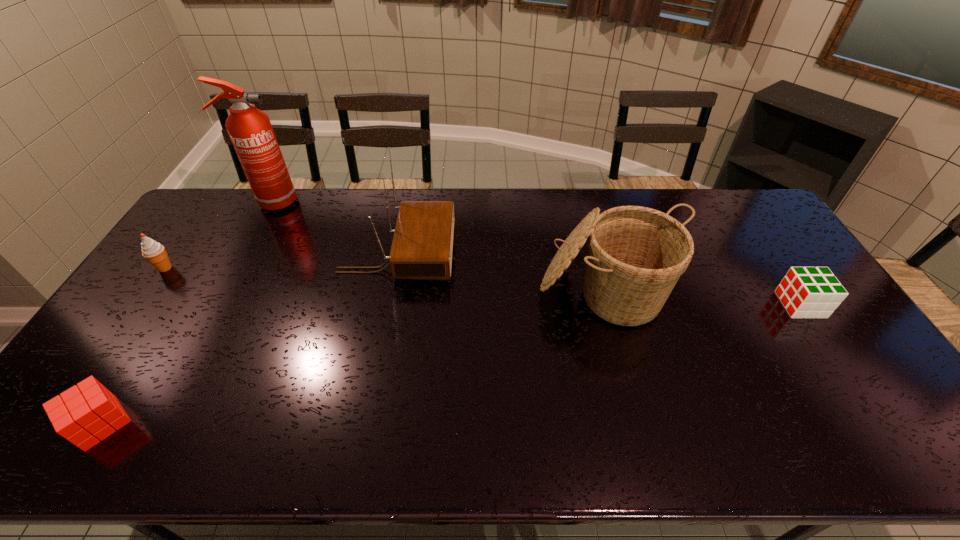
Find the location of a particular element. The width and height of the screenshot is (960, 540). vacant area at the right edge of the desktop is located at coordinates (825, 334).

This screenshot has height=540, width=960. In the image, there is a desktop. Identify the location of vacant space at the near right corner. (902, 446).

In order to click on unoccupied position between the radio_receiver and the basket in this screenshot , I will do `click(501, 272)`.

Identify the location of free space between the fourth object from left to right and the basket. pyautogui.click(x=501, y=272).

Identify the location of free space between the right cube and the fifth object from left to right. (703, 297).

Find the location of `empty space that is in between the nearest object and the leftmost object`. empty space that is in between the nearest object and the leftmost object is located at coordinates (133, 346).

You are a GUI agent. You are given a task and a screenshot of the screen. Output one action in this format:
    pyautogui.click(x=<x>, y=<y>)
    Task: Click on the free space between the fire extinguisher and the icecream
    This screenshot has width=960, height=540.
    Given the screenshot: What is the action you would take?
    pyautogui.click(x=218, y=235)

Where is `free space between the left cube and the right cube`? This screenshot has width=960, height=540. free space between the left cube and the right cube is located at coordinates (450, 364).

In order to click on empty space between the right cube and the fifth object from left to right in this screenshot , I will do `click(703, 297)`.

Find the location of a particular element. The height and width of the screenshot is (540, 960). free area in between the nearest object and the rightmost object is located at coordinates (450, 364).